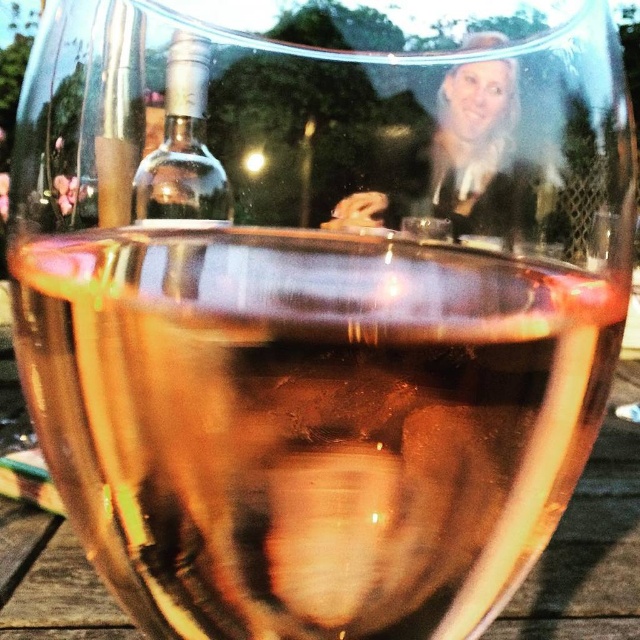
You are at a wine tasting event and want to grab the clear glass bottle at upper center without accidentally touching the matte black hair at upper center. Can you safely reach for the bottle if your hand moves within 1 inch of it?

The distance between the matte black hair at upper center and the clear glass bottle at upper center is 0.91 inches. Since your hand would move within 1 inch, there might be a slight risk of contact, but it could be managed carefully.